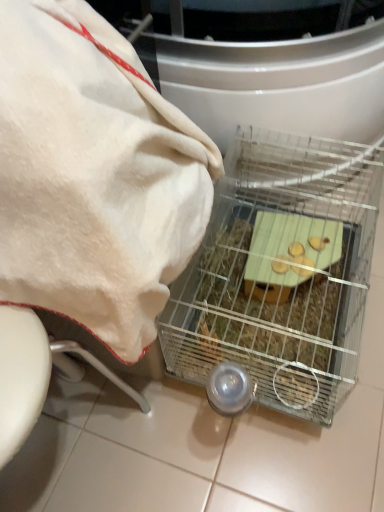
What do you see at coordinates (281, 272) in the screenshot? This screenshot has height=512, width=384. I see `clear wire cage at center` at bounding box center [281, 272].

Where is `clear wire cage at center`? This screenshot has width=384, height=512. clear wire cage at center is located at coordinates (281, 272).

Describe the element at coordinates (93, 176) in the screenshot. I see `white soft towel at upper left` at that location.

This screenshot has height=512, width=384. What are the coordinates of `white soft towel at upper left` in the screenshot? It's located at (93, 176).

You are a GUI agent. You are given a task and a screenshot of the screen. Output one action in this format:
    pyautogui.click(x=<x>, y=<y>)
    Task: Click on the clear wire cage at center
    The image size is (384, 512).
    Given the screenshot: What is the action you would take?
    (281, 272)

Visually, is clear wire cage at center positioned to the left or to the right of white soft towel at upper left?

Clearly, clear wire cage at center is on the right of white soft towel at upper left in the image.

Is clear wire cage at center positioned before white soft towel at upper left?

No, clear wire cage at center is further to the viewer.

Which is closer, (241, 350) or (165, 144)?

The point (165, 144) is in front.

From the image's perspective, which is above, clear wire cage at center or white soft towel at upper left?

white soft towel at upper left is shown above in the image.

From a real-world perspective, who is located higher, clear wire cage at center or white soft towel at upper left?

white soft towel at upper left is physically above.

Considering the relative sizes of clear wire cage at center and white soft towel at upper left in the image provided, is clear wire cage at center wider than white soft towel at upper left?

Correct, the width of clear wire cage at center exceeds that of white soft towel at upper left.

Can you confirm if clear wire cage at center is taller than white soft towel at upper left?

No, clear wire cage at center is not taller than white soft towel at upper left.

Which of these two, clear wire cage at center or white soft towel at upper left, is bigger?

white soft towel at upper left is bigger.

Would you say clear wire cage at center is outside white soft towel at upper left?

Yes, clear wire cage at center is located beyond the bounds of white soft towel at upper left.

Does clear wire cage at center touch white soft towel at upper left?

There is a gap between clear wire cage at center and white soft towel at upper left.

Is clear wire cage at center looking in the opposite direction of white soft towel at upper left?

No, white soft towel at upper left is not at the back of clear wire cage at center.

Can you tell me how much clear wire cage at center and white soft towel at upper left differ in facing direction?

The facing directions of clear wire cage at center and white soft towel at upper left are 87.6 degrees apart.

What are the coordinates of `towel that is on the left side of clear wire cage at center` in the screenshot? It's located at (93, 176).

Is white soft towel at upper left to the left or to the right of clear wire cage at center in the image?

Based on their positions, white soft towel at upper left is located to the left of clear wire cage at center.

Is white soft towel at upper left positioned in front of clear wire cage at center?

Yes, it is in front of clear wire cage at center.

Is point (62, 160) positioned before point (334, 175)?

Yes, it is in front of point (334, 175).

From the image's perspective, is white soft towel at upper left under clear wire cage at center?

No, from the image's perspective, white soft towel at upper left is not beneath clear wire cage at center.

From a real-world perspective, is white soft towel at upper left under clear wire cage at center?

Incorrect, from a real-world perspective, white soft towel at upper left is higher than clear wire cage at center.

Which object is wider, white soft towel at upper left or clear wire cage at center?

clear wire cage at center.

From their relative heights in the image, would you say white soft towel at upper left is taller or shorter than clear wire cage at center?

Considering their sizes, white soft towel at upper left has more height than clear wire cage at center.

Can you confirm if white soft towel at upper left is smaller than clear wire cage at center?

Actually, white soft towel at upper left might be larger than clear wire cage at center.

Is clear wire cage at center located within white soft towel at upper left?

No.

Is white soft towel at upper left positioned far away from clear wire cage at center?

white soft towel at upper left is near clear wire cage at center, not far away.

Is white soft towel at upper left facing towards clear wire cage at center?

No, white soft towel at upper left is not oriented towards clear wire cage at center.

Identify the location of appliance on the right of white soft towel at upper left. (281, 272).

Locate an element on the screen. appliance directly beneath the white soft towel at upper left (from a real-world perspective) is located at coordinates (281, 272).

Find the location of a particular element. The width and height of the screenshot is (384, 512). appliance behind the white soft towel at upper left is located at coordinates (281, 272).